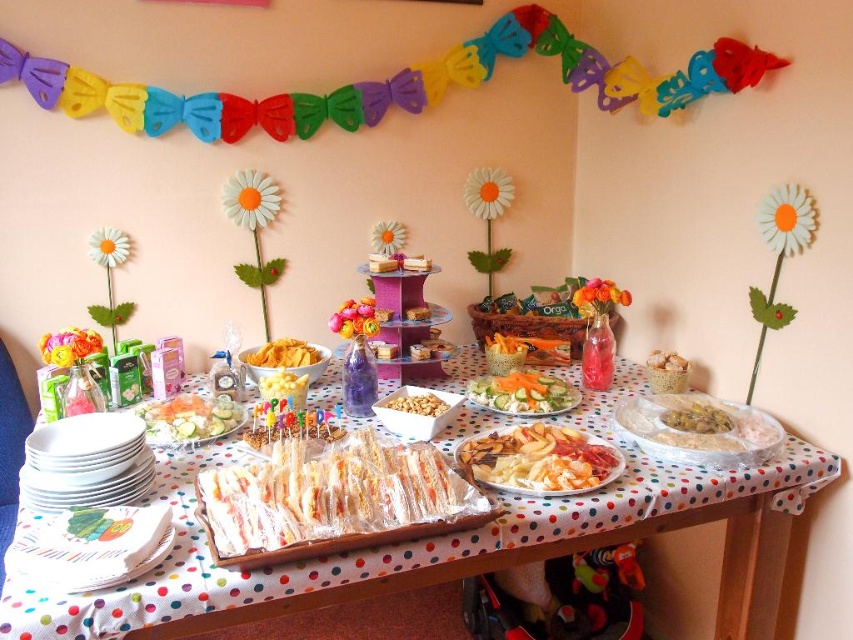
You are a party planner organizing a childrens event. You have two items on the table, a clear plastic platter at center and yellow crispy chips at center. Which one takes up more space on the table?

The clear plastic platter at center is bigger than yellow crispy chips at center, so it takes up more space on the table.

You are a caterer arranging the yellow creamy rice at center on the white polka dot tablecloth at center. Can you place the rice in the center of the tablecloth without it hanging over the edges?

The white polka dot tablecloth at center is wider than the yellow creamy rice at center, so placing the rice in the center would allow it to fit without overhanging the edges.

You are a guest at the party and want to grab a chip from the yellow crispy chips at center. However, there is a clear plastic platter at center blocking your access. Can you reach the chips without moving the platter?

The clear plastic platter at center is in front of the yellow crispy chips at center, so you cannot reach the chips without moving the platter.